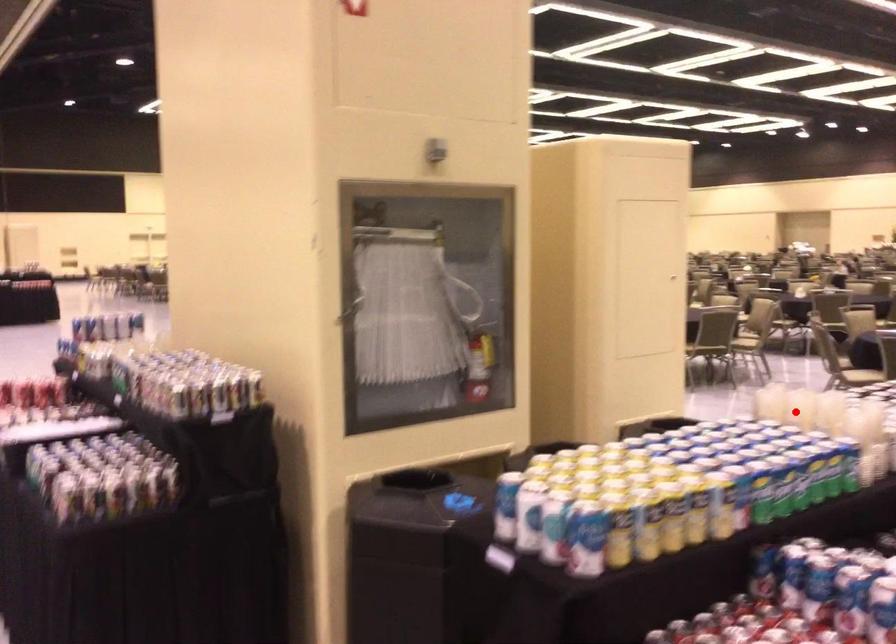
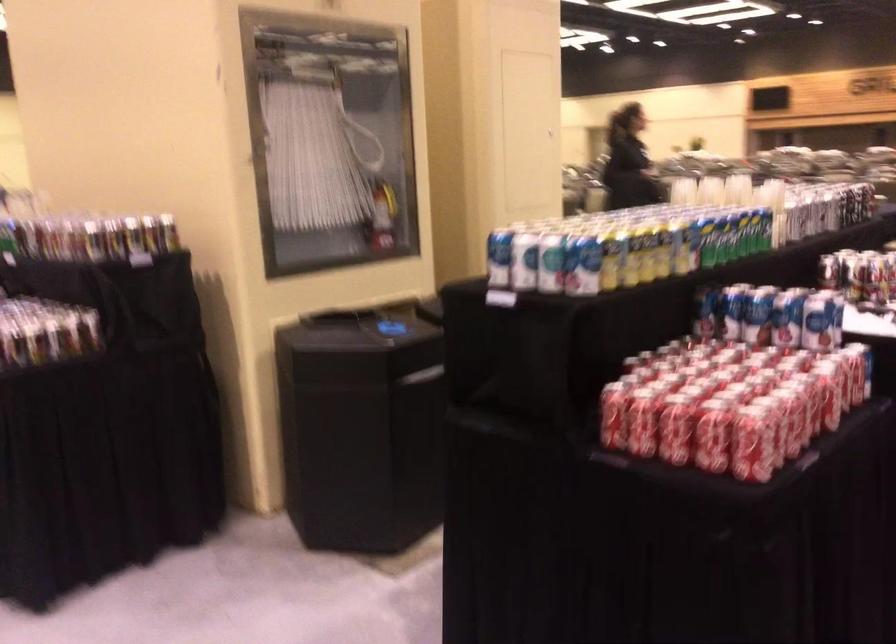
Question: I am providing you with two images of the same scene from different viewpoints. Given a red point in image1, look at the same physical point in image2. Is it:

Choices:
 (A) Closer to the viewpoint
 (B) Farther from the viewpoint

Answer: (B)